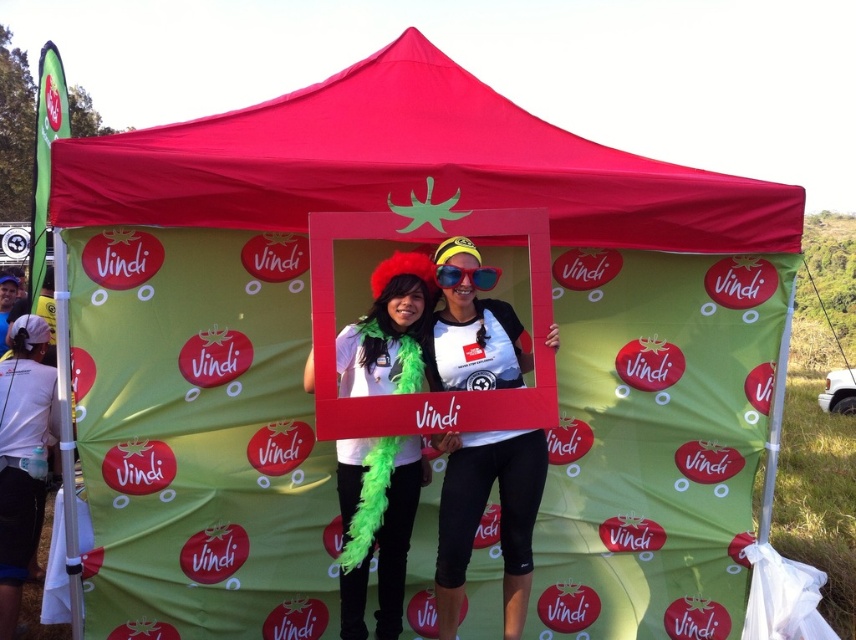
Is blue reflective sunglasses at center above matte white shirt at left?

Yes.

Does blue reflective sunglasses at center have a greater height compared to matte white shirt at left?

Incorrect, blue reflective sunglasses at center's height is not larger of matte white shirt at left's.

Which is in front, point (452, 285) or point (0, 330)?

Positioned in front is point (452, 285).

Identify the location of blue reflective sunglasses at center. (467, 276).

Which is in front, point (443, 586) or point (479, 284)?

Positioned in front is point (479, 284).

Locate an element on the screen. The image size is (856, 640). white matte t-shirt at center is located at coordinates (480, 515).

Can you confirm if white matte feather boa at center is positioned above matte white shirt at left?

Incorrect, white matte feather boa at center is not positioned above matte white shirt at left.

Is point (310, 362) more distant than point (4, 280)?

That is False.

Where is `white matte feather boa at center`? The height and width of the screenshot is (640, 856). white matte feather boa at center is located at coordinates (376, 525).